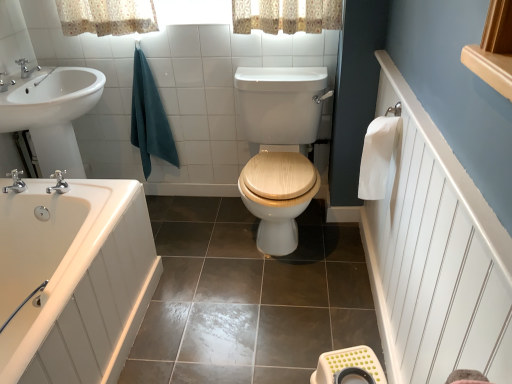
Question: From the image's perspective, does white paper towel at right, the 1th bath towel viewed from the right, appear lower than silver metallic faucet at upper left, the second tap when ordered from front to back?

Choices:
 (A) no
 (B) yes

Answer: (B)

Question: Is white paper towel at right, the 1th bath towel viewed from the right, not inside silver metallic faucet at upper left, the second tap from the back?

Choices:
 (A) no
 (B) yes

Answer: (B)

Question: Is white paper towel at right, which ranks as the 1th bath towel in front-to-back order, shorter than silver metallic faucet at upper left, the second tap from the back?

Choices:
 (A) no
 (B) yes

Answer: (A)

Question: Is white paper towel at right, the 1th bath towel viewed from the right, not close to silver metallic faucet at upper left, acting as the second tap starting from the top?

Choices:
 (A) no
 (B) yes

Answer: (B)

Question: Does white paper towel at right, which ranks as the 1th bath towel in front-to-back order, have a smaller size compared to silver metallic faucet at upper left, the second tap from the back?

Choices:
 (A) yes
 (B) no

Answer: (B)

Question: Considering the positions of wooden at center and white paper towel at right, the second bath towel from the back, in the image, is wooden at center bigger or smaller than white paper towel at right, the second bath towel from the back,?

Choices:
 (A) big
 (B) small

Answer: (A)

Question: Would you say wooden at center is inside or outside white paper towel at right, the second bath towel from the back?

Choices:
 (A) outside
 (B) inside

Answer: (A)

Question: In the image, is wooden at center positioned in front of or behind white paper towel at right, which ranks as the 1th bath towel in front-to-back order?

Choices:
 (A) behind
 (B) front

Answer: (A)

Question: From their relative heights in the image, would you say wooden at center is taller or shorter than white paper towel at right, which ranks as the 1th bath towel in front-to-back order?

Choices:
 (A) tall
 (B) short

Answer: (A)

Question: Is white glossy bathtub at lower left wider or thinner than brushed metal faucet at upper left, which ranks as the 3th tap in bottom-to-top order?

Choices:
 (A) thin
 (B) wide

Answer: (B)

Question: From a real-world perspective, is white glossy bathtub at lower left above or below brushed metal faucet at upper left, which ranks as the 3th tap in bottom-to-top order?

Choices:
 (A) below
 (B) above

Answer: (A)

Question: Is white glossy bathtub at lower left to the left or to the right of brushed metal faucet at upper left, which is the third tap in front-to-back order, in the image?

Choices:
 (A) left
 (B) right

Answer: (B)

Question: Would you say white glossy bathtub at lower left is inside or outside brushed metal faucet at upper left, which ranks as the 3th tap in bottom-to-top order?

Choices:
 (A) outside
 (B) inside

Answer: (A)

Question: Is teal cotton towel at upper left, which appears as the second bath towel when viewed from the front, situated inside white paper towel at right, which ranks as the second bath towel in left-to-right order, or outside?

Choices:
 (A) inside
 (B) outside

Answer: (B)

Question: Considering the positions of point (143, 172) and point (362, 160), is point (143, 172) closer or farther from the camera than point (362, 160)?

Choices:
 (A) closer
 (B) farther

Answer: (B)